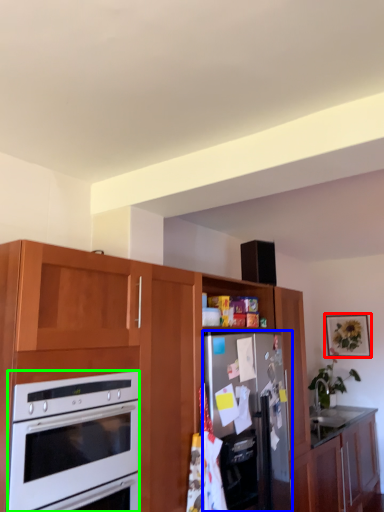
Question: Which object is the farthest from picture frame (highlighted by a red box)? Choose among these: refrigerator (highlighted by a blue box) or oven (highlighted by a green box).

Choices:
 (A) refrigerator
 (B) oven

Answer: (B)